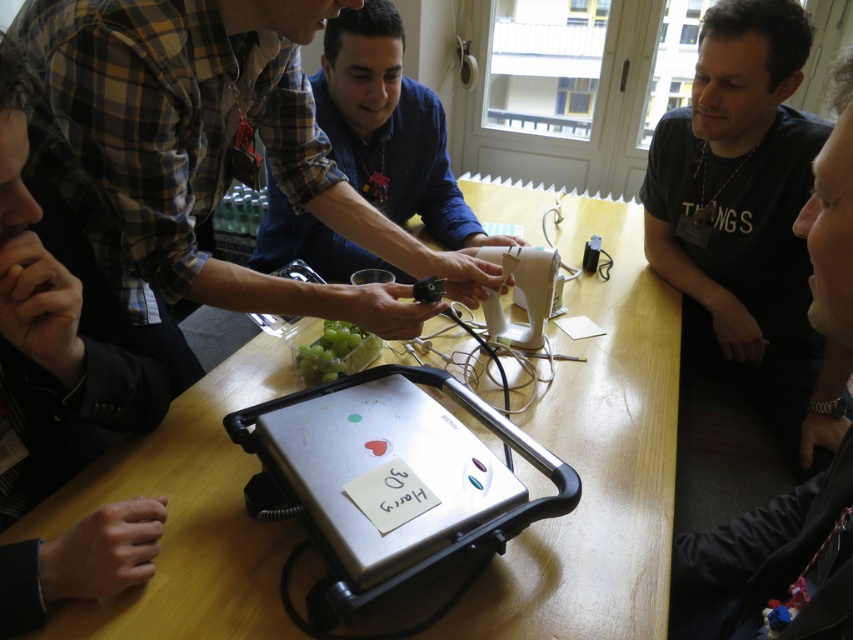
Who is higher up, matte black shirt at upper center or white plastic remote control at center?

matte black shirt at upper center is above.

Is point (457, 218) less distant than point (515, 346)?

No.

Based on the photo, measure the distance between matte black shirt at upper center and camera.

matte black shirt at upper center and camera are 4.33 feet apart from each other.

Locate an element on the screen. This screenshot has height=640, width=853. matte black shirt at upper center is located at coordinates (389, 125).

This screenshot has width=853, height=640. Describe the element at coordinates (747, 225) in the screenshot. I see `black matte shirt at upper right` at that location.

Does point (706, 77) lie in front of point (293, 352)?

That is False.

Where is `black matte shirt at upper right`? The width and height of the screenshot is (853, 640). black matte shirt at upper right is located at coordinates (747, 225).

Locate an element on the screen. The width and height of the screenshot is (853, 640). black matte shirt at upper right is located at coordinates (747, 225).

The image size is (853, 640). What are the coordinates of `black matte shirt at upper right` in the screenshot? It's located at (747, 225).

Where is `black matte shirt at upper right`? Image resolution: width=853 pixels, height=640 pixels. black matte shirt at upper right is located at coordinates (747, 225).